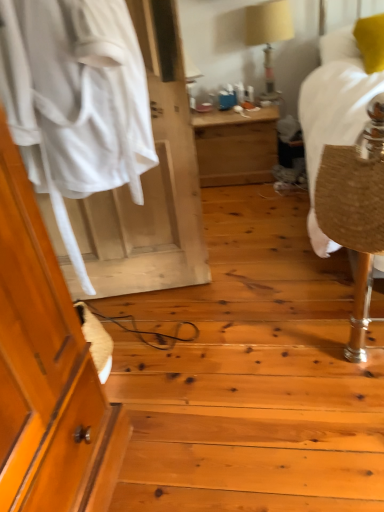
What do you see at coordinates (151, 183) in the screenshot? I see `white fabric at left` at bounding box center [151, 183].

What do you see at coordinates (268, 35) in the screenshot? Image resolution: width=384 pixels, height=512 pixels. I see `beige fabric lampshade at upper center` at bounding box center [268, 35].

Where is `burlap-like fabric at right`? This screenshot has height=512, width=384. burlap-like fabric at right is located at coordinates (333, 112).

Where is `white fabric at left`? This screenshot has height=512, width=384. white fabric at left is located at coordinates (151, 183).

From the picture: Does wooden desk at center have a greater height compared to beige fabric lampshade at upper center?

In fact, wooden desk at center may be shorter than beige fabric lampshade at upper center.

From the picture: Which of these two, wooden desk at center or beige fabric lampshade at upper center, is thinner?

beige fabric lampshade at upper center is thinner.

Considering the positions of objects wooden desk at center and beige fabric lampshade at upper center in the image provided, who is more to the left, wooden desk at center or beige fabric lampshade at upper center?

Positioned to the left is wooden desk at center.

What's the angular difference between wooden desk at center and beige fabric lampshade at upper center's facing directions?

The angular difference between wooden desk at center and beige fabric lampshade at upper center is 1.03 degrees.

From a real-world perspective, is white fabric at left below wooden desk at center?

No, from a real-world perspective, white fabric at left is not below wooden desk at center.

At what (x,y) coordinates should I click in order to perform the action: click on nightstand that appears behind the white fabric at left. Please return your answer as a coordinate pair (x, y). This screenshot has height=512, width=384. Looking at the image, I should click on (236, 146).

Is the depth of white fabric at left greater than that of wooden desk at center?

No.

Considering the points (187, 246) and (259, 135), which point is in front, point (187, 246) or point (259, 135)?

Positioned in front is point (187, 246).

Is white fabric at left bigger or smaller than burlap-like fabric at right?

Considering their sizes, white fabric at left takes up more space than burlap-like fabric at right.

Which is farther from the camera, (x=115, y=256) or (x=314, y=214)?

The point (x=115, y=256) is behind.

From the image's perspective, relative to burlap-like fabric at right, is white fabric at left above or below?

Clearly, from the image's perspective, white fabric at left is above burlap-like fabric at right.

From a real-world perspective, is wooden desk at center positioned under white fabric at left based on gravity?

Yes, from a real-world perspective, wooden desk at center is below white fabric at left.

Between wooden desk at center and white fabric at left, which one has larger size?

With larger size is white fabric at left.

In terms of width, does wooden desk at center look wider or thinner when compared to white fabric at left?

Considering their sizes, wooden desk at center looks broader than white fabric at left.

Which is more to the left, burlap-like fabric at right or wooden desk at center?

From the viewer's perspective, wooden desk at center appears more on the left side.

Is the depth of burlap-like fabric at right greater than that of wooden desk at center?

No, it is not.

Can you tell me how much burlap-like fabric at right and wooden desk at center differ in facing direction?

59.1 degrees separate the facing orientations of burlap-like fabric at right and wooden desk at center.

Is burlap-like fabric at right next to wooden desk at center and touching it?

burlap-like fabric at right and wooden desk at center are not in contact.

Does beige fabric lampshade at upper center have a lesser height compared to white fabric at left?

Indeed, beige fabric lampshade at upper center has a lesser height compared to white fabric at left.

Is beige fabric lampshade at upper center with white fabric at left?

No, beige fabric lampshade at upper center is not beside white fabric at left.

Consider the image. In terms of width, does beige fabric lampshade at upper center look wider or thinner when compared to white fabric at left?

Considering their sizes, beige fabric lampshade at upper center looks broader than white fabric at left.

Measure the distance between beige fabric lampshade at upper center and white fabric at left.

beige fabric lampshade at upper center is 5.11 feet from white fabric at left.

From a real-world perspective, is yellow fabric pillow at upper right under white fabric at left?

No, from a real-world perspective, yellow fabric pillow at upper right is not beneath white fabric at left.

How many degrees apart are the facing directions of yellow fabric pillow at upper right and white fabric at left?

There is a 3.54-degree angle between the facing directions of yellow fabric pillow at upper right and white fabric at left.

Is yellow fabric pillow at upper right at the right side of white fabric at left?

Yes.

Does yellow fabric pillow at upper right touch white fabric at left?

No, yellow fabric pillow at upper right is not beside white fabric at left.

Locate an element on the screen. This screenshot has height=512, width=384. nightstand below the beige fabric lampshade at upper center (from the image's perspective) is located at coordinates (236, 146).

You are a GUI agent. You are given a task and a screenshot of the screen. Output one action in this format:
    pyautogui.click(x=<x>, y=<y>)
    Task: Click on the nightstand behind the white fabric at left
    This screenshot has height=512, width=384.
    Given the screenshot: What is the action you would take?
    pyautogui.click(x=236, y=146)

When comparing their distances from white fabric at left, does wooden desk at center or beige fabric lampshade at upper center seem further?

The object further to white fabric at left is beige fabric lampshade at upper center.

When comparing their distances from white fabric at left, does wooden desk at center or yellow fabric pillow at upper right seem closer?

wooden desk at center is positioned closer to the anchor white fabric at left.

Which object lies further to the anchor point wooden desk at center, yellow fabric pillow at upper right or white fabric at left?

Among the two, white fabric at left is located further to wooden desk at center.

When comparing their distances from yellow fabric pillow at upper right, does beige fabric lampshade at upper center or white fabric at left seem closer?

beige fabric lampshade at upper center lies closer to yellow fabric pillow at upper right than the other object.

Based on their spatial positions, is wooden desk at center or yellow fabric pillow at upper right further from burlap-like fabric at right?

Based on the image, wooden desk at center appears to be further to burlap-like fabric at right.

From the image, which object appears to be nearer to white fabric at left, beige fabric lampshade at upper center or yellow fabric pillow at upper right?

yellow fabric pillow at upper right is closer to white fabric at left.

Based on their spatial positions, is wooden desk at center or white fabric at left closer to yellow fabric pillow at upper right?

Based on the image, wooden desk at center appears to be nearer to yellow fabric pillow at upper right.

Based on the photo, considering their positions, is beige fabric lampshade at upper center positioned further to burlap-like fabric at right than white fabric at left?

white fabric at left.

Locate an element on the screen. bed between white fabric at left and yellow fabric pillow at upper right from left to right is located at coordinates (333, 112).

Find the location of `table lamp between burlap-like fabric at right and wooden desk at center from front to back`. table lamp between burlap-like fabric at right and wooden desk at center from front to back is located at coordinates (268, 35).

This screenshot has height=512, width=384. What are the coordinates of `table lamp between wooden desk at center and yellow fabric pillow at upper right in the horizontal direction` in the screenshot? It's located at (268, 35).

Where is `table lamp located between white fabric at left and wooden desk at center in the depth direction`? Image resolution: width=384 pixels, height=512 pixels. table lamp located between white fabric at left and wooden desk at center in the depth direction is located at coordinates (268, 35).